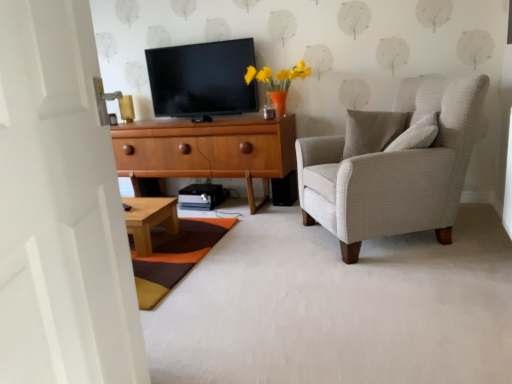
Question: Considering the positions of light gray fabric armchair at right and white wooden door at left in the image, is light gray fabric armchair at right wider or thinner than white wooden door at left?

Choices:
 (A) wide
 (B) thin

Answer: (A)

Question: In the image, is light gray fabric armchair at right on the left side or the right side of white wooden door at left?

Choices:
 (A) right
 (B) left

Answer: (A)

Question: Estimate the real-world distances between objects in this image. Which object is farther from the white wooden door at left?

Choices:
 (A) light gray fabric armchair at right
 (B) multicolored woven mat at lower center
 (C) black glossy tv at upper center
 (D) white carpet at center
 (E) light wood/texture coffee table at lower left

Answer: (C)

Question: Estimate the real-world distances between objects in this image. Which object is farther from the light wood/texture coffee table at lower left?

Choices:
 (A) white wooden door at left
 (B) wooden cabinet at center
 (C) light gray fabric armchair at right
 (D) multicolored woven mat at lower center
 (E) black glossy tv at upper center

Answer: (A)